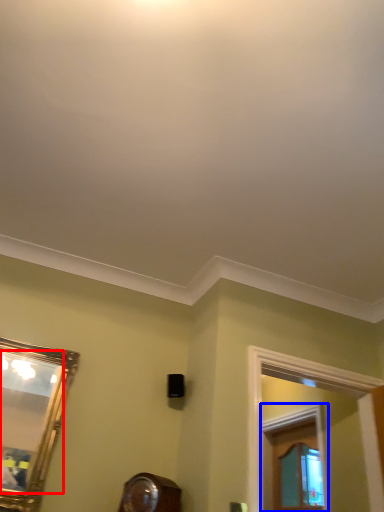
Question: Which object is closer to the camera taking this photo, mirror (highlighted by a red box) or window frame (highlighted by a blue box)?

Choices:
 (A) mirror
 (B) window frame

Answer: (A)